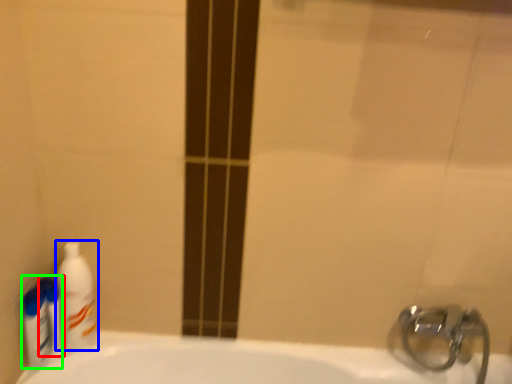
Question: Which object is positioned farthest from mouthwash (highlighted by a red box)? Select from cleaning product (highlighted by a blue box) and cleaning product (highlighted by a green box).

Choices:
 (A) cleaning product
 (B) cleaning product

Answer: (A)